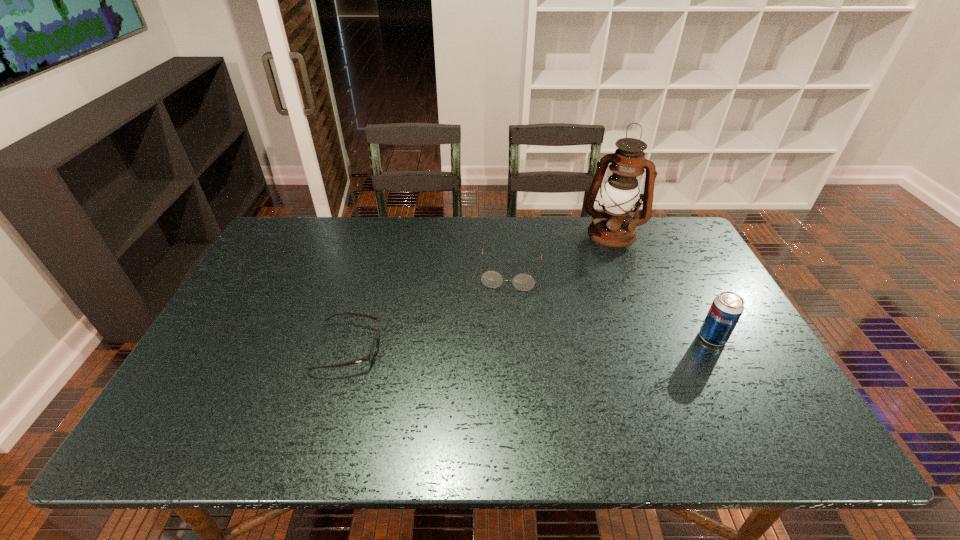
Identify the location of free space on the desktop that is between the leftmost object and the rightmost object and is positioned on the temples of the second object from left to right. (502, 343).

Where is `free space on the desktop that is between the sunglasses and the second tallest object and is positioned on the side of the third object from left to right, there is a wick adjustment knob`? The height and width of the screenshot is (540, 960). free space on the desktop that is between the sunglasses and the second tallest object and is positioned on the side of the third object from left to right, there is a wick adjustment knob is located at coordinates (580, 341).